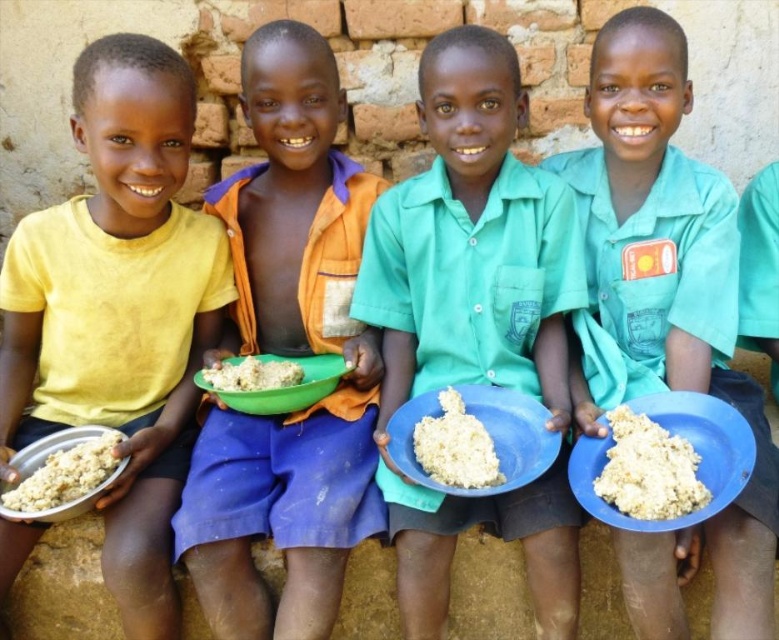
Question: Which of the following is the closest to the observer?

Choices:
 (A) white crumbly food at center
 (B) green plastic bowl at center

Answer: (A)

Question: Which point is closer to the camera taking this photo?

Choices:
 (A) [x=199, y=288]
 (B) [x=325, y=188]
 (C) [x=203, y=376]
 (D) [x=464, y=449]

Answer: (D)

Question: Which is nearer to the white crumbly food at right?

Choices:
 (A) yellow matte shirt at left
 (B) green plastic bowl at center
 (C) white matte food at center

Answer: (B)

Question: From the image, what is the correct spatial relationship of teal matte shirt at center in relation to white crumbly food at center?

Choices:
 (A) below
 (B) above

Answer: (B)

Question: Does white crumbly food at right appear on the right side of white matte food at center?

Choices:
 (A) yes
 (B) no

Answer: (A)

Question: Can you confirm if blue matte plate at center is positioned to the right of green plastic bowl at center?

Choices:
 (A) no
 (B) yes

Answer: (B)